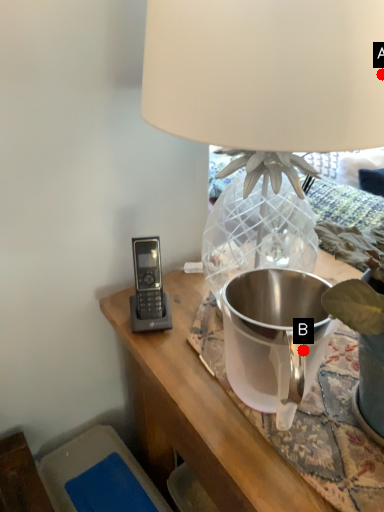
Question: Two points are circled on the image, labeled by A and B beside each circle. Which point appears farthest from the camera in this image?

Choices:
 (A) A is further
 (B) B is further

Answer: (B)